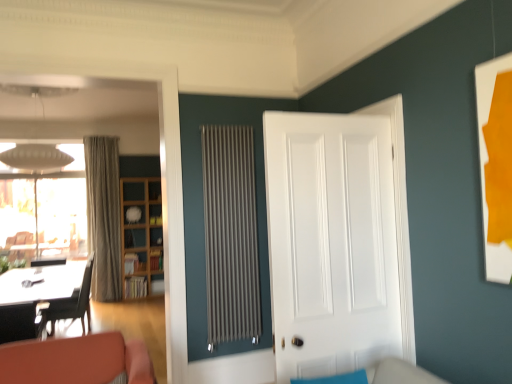
Question: Looking at the image, does white glossy picture frame at right seem bigger or smaller compared to white smooth door at center?

Choices:
 (A) small
 (B) big

Answer: (A)

Question: Which is correct: white glossy picture frame at right is inside white smooth door at center, or outside of it?

Choices:
 (A) inside
 (B) outside

Answer: (B)

Question: Estimate the real-world distances between objects in this image. Which object is closer to the white glossy picture frame at right?

Choices:
 (A) matte gray radiator at center
 (B) transparent glass window at upper left
 (C) white smooth door at center
 (D) woodenmaterial/texturebookshelf at left
 (E) beige textured curtain at left

Answer: (C)

Question: Which object is positioned farthest from the woodenmaterial/texturebookshelf at left?

Choices:
 (A) transparent glass window at upper left
 (B) matte gray radiator at center
 (C) teal fabric couch at lower center
 (D) black leather chair at left
 (E) beige textured curtain at left

Answer: (C)